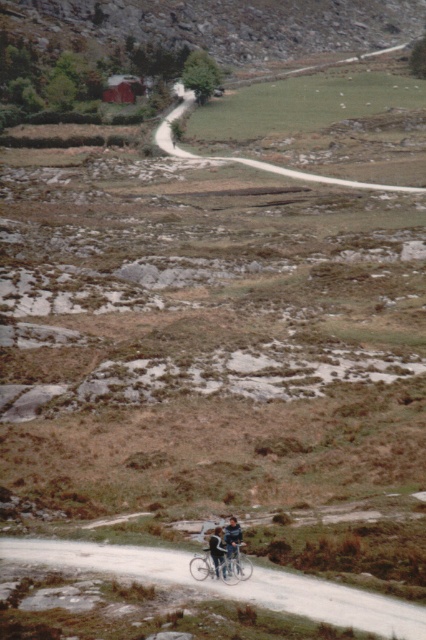
You are standing at the edge of the road in this rural scene and notice the smooth gravel path at center and the denim pants at lower center. Which object is nearer to you?

The smooth gravel path at center is closer to the viewer than the denim pants at lower center.

You are planning to ride your metallic silver mountain bike at lower center along the smooth gravel path at center. Considering their heights, will the bike be able to pass under any low hanging branches or obstacles on the path?

The smooth gravel path at center has a lesser height compared to metallic silver mountain bike at lower center, meaning the path is shorter in height than the bike. Therefore, the bike may not be able to pass under low hanging branches or obstacles on the path.

You are standing at the starting point of the dirt road in the image and want to reach a destination located at point (219, 548). There is an obstacle at point (238, 573) that you must avoid. Which point should you head towards first to navigate around the obstacle?

You should head towards point (238, 573) first because it is closer to you than point (219, 548), allowing you to detour around the obstacle safely.